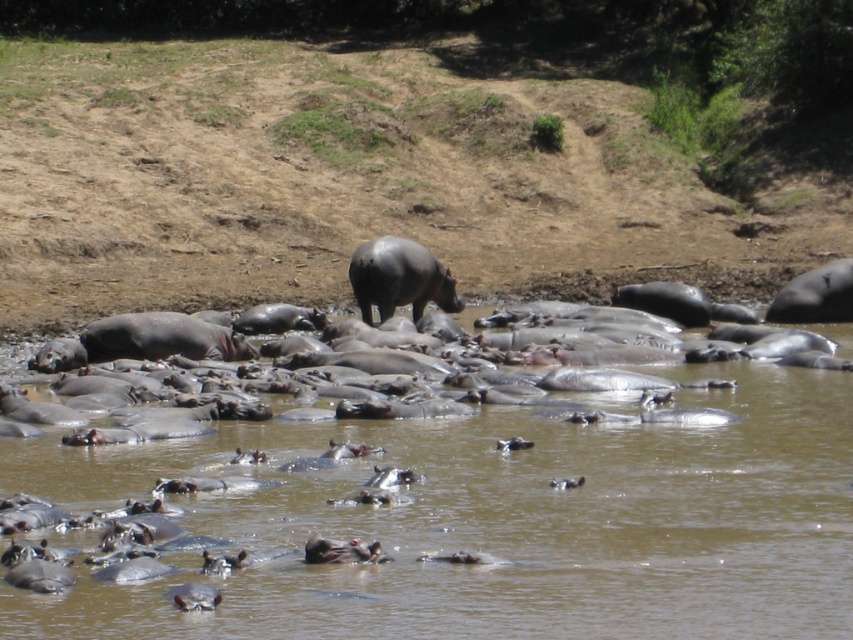
Question: Is the position of brown matte hippopotamus at center more distant than that of gray matte hippo at right?

Choices:
 (A) no
 (B) yes

Answer: (A)

Question: Does brown matte hippopotamus at center appear on the left side of gray matte hippo at center?

Choices:
 (A) yes
 (B) no

Answer: (B)

Question: Which object is closer to the camera taking this photo?

Choices:
 (A) gray matte hippo at center
 (B) brown matte hippopotamus at center
 (C) gray matte hippo at right

Answer: (B)

Question: Which point appears closest to the camera in this image?

Choices:
 (A) (474, 500)
 (B) (383, 257)
 (C) (830, 317)

Answer: (A)

Question: Which object appears farthest from the camera in this image?

Choices:
 (A) brown matte hippopotamus at center
 (B) gray matte hippo at right
 (C) gray matte hippo at center

Answer: (B)

Question: Where is brown matte hippopotamus at center located in relation to gray matte hippo at center in the image?

Choices:
 (A) left
 (B) right

Answer: (B)